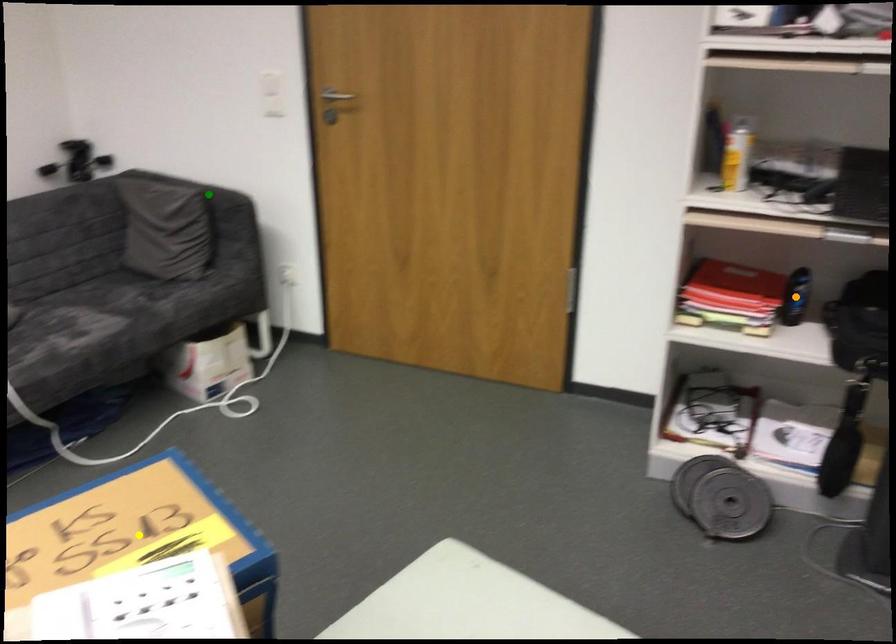
Order these from farthest to nearest:
- green point
- yellow point
- orange point

green point → orange point → yellow point